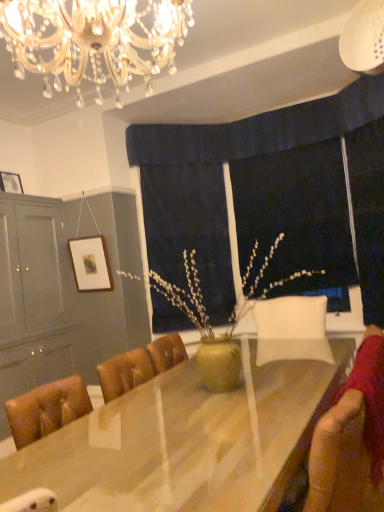
Question: From the image's perspective, is wooden framed picture at upper left, acting as the second picture frame starting from the right, over matte gray cabinet at left?

Choices:
 (A) no
 (B) yes

Answer: (B)

Question: From a real-world perspective, is wooden framed picture at upper left, the first picture frame positioned from the left, under matte gray cabinet at left?

Choices:
 (A) no
 (B) yes

Answer: (A)

Question: Considering the relative sizes of wooden framed picture at upper left, which is the 2th picture frame in bottom-to-top order, and matte gray cabinet at left in the image provided, is wooden framed picture at upper left, which is the 2th picture frame in bottom-to-top order, smaller than matte gray cabinet at left?

Choices:
 (A) no
 (B) yes

Answer: (B)

Question: Is wooden framed picture at upper left, acting as the second picture frame starting from the right, wider than matte gray cabinet at left?

Choices:
 (A) yes
 (B) no

Answer: (B)

Question: From the image's perspective, does wooden framed picture at upper left, which is the first picture frame from top to bottom, appear lower than matte gray cabinet at left?

Choices:
 (A) yes
 (B) no

Answer: (B)

Question: Is black fabric at center wider or thinner than dark blue fabric at center?

Choices:
 (A) wide
 (B) thin

Answer: (A)

Question: From the image's perspective, is black fabric at center above or below dark blue fabric at center?

Choices:
 (A) above
 (B) below

Answer: (B)

Question: In the image, is black fabric at center positioned in front of or behind dark blue fabric at center?

Choices:
 (A) front
 (B) behind

Answer: (A)

Question: Do you think black fabric at center is within dark blue fabric at center, or outside of it?

Choices:
 (A) outside
 (B) inside

Answer: (A)

Question: Would you say velvet brown swivel chair at lower right is inside or outside wooden framed picture at upper left, which is the first picture frame from top to bottom?

Choices:
 (A) outside
 (B) inside

Answer: (A)

Question: Considering the positions of velvet brown swivel chair at lower right and wooden framed picture at upper left, which is the 2th picture frame in bottom-to-top order, in the image, is velvet brown swivel chair at lower right bigger or smaller than wooden framed picture at upper left, which is the 2th picture frame in bottom-to-top order,?

Choices:
 (A) big
 (B) small

Answer: (A)

Question: From a real-world perspective, is velvet brown swivel chair at lower right above or below wooden framed picture at upper left, which is the 2th picture frame in bottom-to-top order?

Choices:
 (A) above
 (B) below

Answer: (B)

Question: Does point (342, 394) appear closer or farther from the camera than point (13, 174)?

Choices:
 (A) farther
 (B) closer

Answer: (B)

Question: From their relative heights in the image, would you say wooden picture frame at upper left, acting as the 2th picture frame starting from the top, is taller or shorter than crystal glass chandelier at upper center?

Choices:
 (A) short
 (B) tall

Answer: (A)

Question: From a real-world perspective, is wooden picture frame at upper left, positioned as the 2th picture frame in left-to-right order, physically located above or below crystal glass chandelier at upper center?

Choices:
 (A) below
 (B) above

Answer: (A)